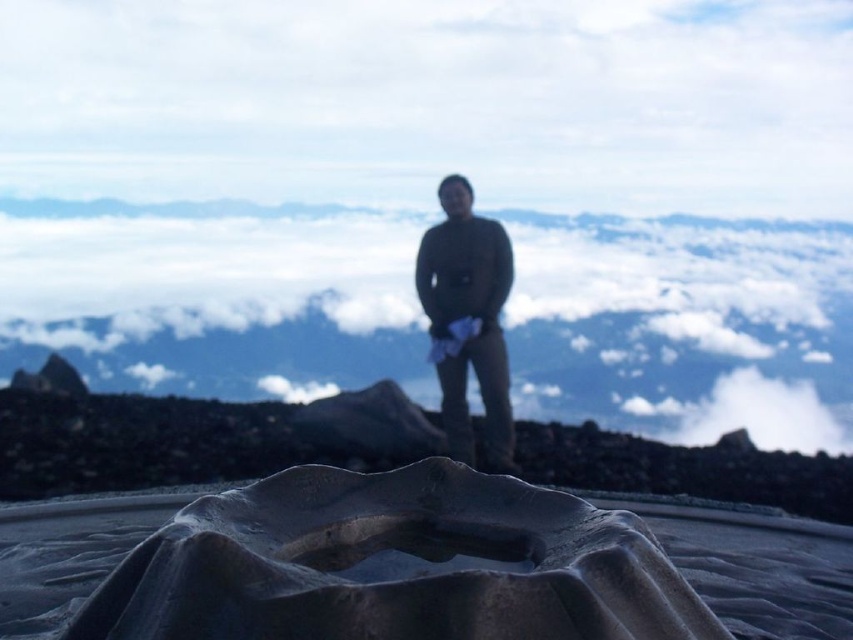
Question: Does silvery metallic blanket at center appear on the left side of dark green sweater at center?

Choices:
 (A) no
 (B) yes

Answer: (B)

Question: Which point is closer to the camera?

Choices:
 (A) (61, 433)
 (B) (469, 349)

Answer: (B)

Question: Which point is farther to the camera?

Choices:
 (A) (498, 304)
 (B) (229, 408)

Answer: (B)

Question: In this image, where is white fluffy cloud at upper center located relative to dark green sweater at center?

Choices:
 (A) left
 (B) right

Answer: (A)

Question: From the image, what is the correct spatial relationship of rough textured rock at center in relation to dark green sweater at center?

Choices:
 (A) left
 (B) right

Answer: (A)

Question: Which point appears farthest from the camera in this image?

Choices:
 (A) pyautogui.click(x=485, y=310)
 (B) pyautogui.click(x=689, y=477)

Answer: (A)